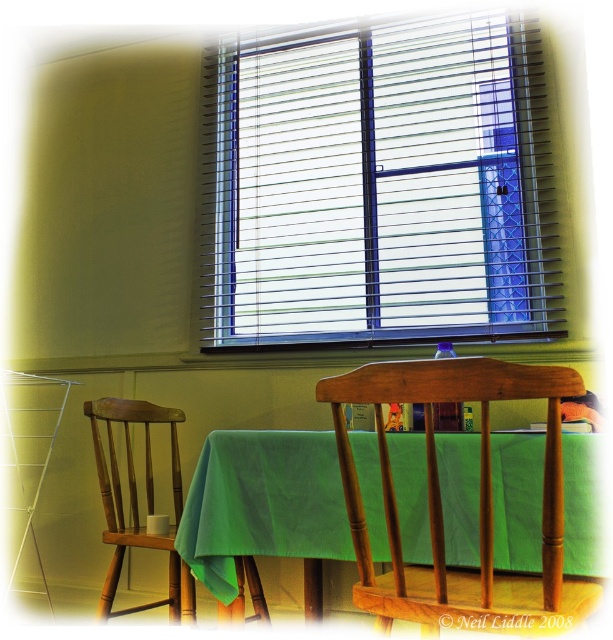
You are sitting in the wooden chair at center and looking up. Can you see the top of the white plastic blinds at upper center?

The white plastic blinds at upper center is much taller than the wooden chair at center, so when sitting in the wooden chair at center, you cannot see the top of the white plastic blinds at upper center because it extends higher than the chair.

You are standing in the room and want to know the exact position of the white plastic blinds at upper center. What are their coordinates?

The white plastic blinds at upper center are located at coordinates [378,186].

Based on the scene description, where is the white plastic blinds at upper center located in terms of coordinates?

The white plastic blinds at upper center is located at point coordinates of (378, 186).